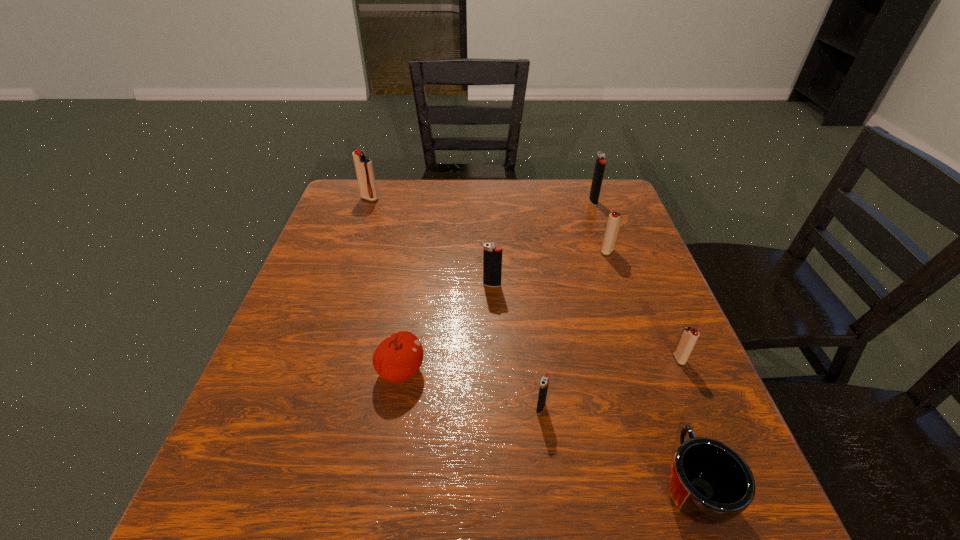
Where is `the rightmost igniter`? the rightmost igniter is located at coordinates (690, 335).

Identify the location of the rightmost red igniter. The image size is (960, 540). (690, 335).

Image resolution: width=960 pixels, height=540 pixels. Find the location of `the fourth igniter from right to left`. the fourth igniter from right to left is located at coordinates (544, 383).

Identify the location of the second black igniter from right to left. The width and height of the screenshot is (960, 540). (544, 383).

I want to click on the nearest object, so click(x=709, y=483).

In order to click on mug in this screenshot , I will do `click(709, 483)`.

Locate an element on the screen. blank space located on the front of the farthest red igniter is located at coordinates (338, 290).

Locate an element on the screen. This screenshot has height=540, width=960. free space located on the left of the biggest black igniter is located at coordinates (528, 201).

Find the location of a particular element. vacant space situated 0.290m on the front of the leftmost black igniter is located at coordinates [495, 395].

Locate an element on the screen. The height and width of the screenshot is (540, 960). blank space located 0.210m on the back of the second biggest red igniter is located at coordinates click(590, 202).